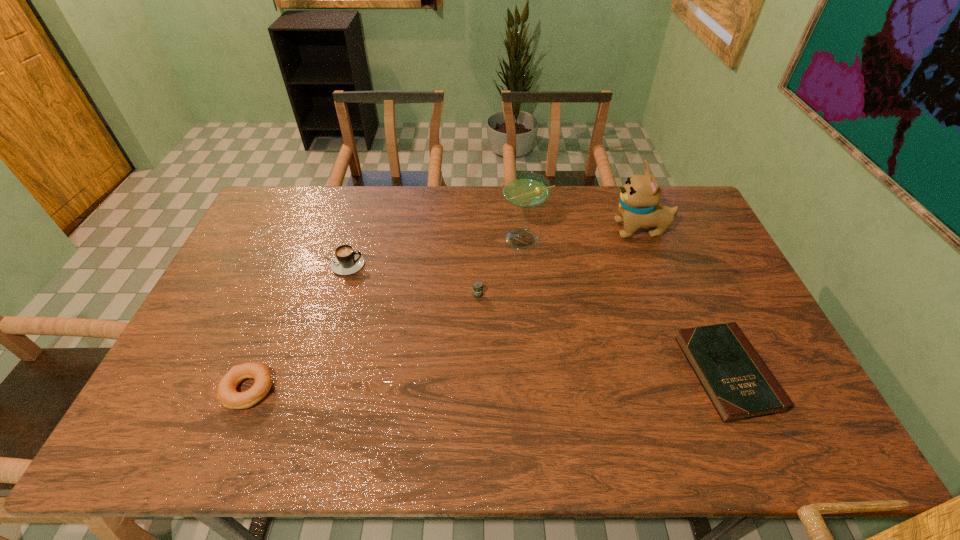
Locate an element on the screen. vacant point located between the bagel and the Bible is located at coordinates (488, 381).

Image resolution: width=960 pixels, height=540 pixels. Find the location of `vacant region between the bagel and the fourth object from right to left`. vacant region between the bagel and the fourth object from right to left is located at coordinates (363, 342).

Where is `free space between the Bible and the beer can`? free space between the Bible and the beer can is located at coordinates click(x=603, y=334).

Identify the location of free space between the martini and the bagel. Image resolution: width=960 pixels, height=540 pixels. (386, 315).

The width and height of the screenshot is (960, 540). Identify the location of free space between the bagel and the martini. (386, 315).

This screenshot has height=540, width=960. I want to click on free space that is in between the bagel and the Bible, so click(x=488, y=381).

I want to click on vacant area between the cappuccino and the third nearest object, so click(410, 280).

The height and width of the screenshot is (540, 960). I want to click on free point between the Bible and the puppy, so click(x=684, y=301).

You are a GUI agent. You are given a task and a screenshot of the screen. Output one action in this format:
    pyautogui.click(x=<x>, y=<y>)
    Task: Click on the fourth closest object to the Bible
    The image size is (960, 540).
    Given the screenshot: What is the action you would take?
    pyautogui.click(x=346, y=262)

Find the location of `object that ranks as the third closest to the bagel`. object that ranks as the third closest to the bagel is located at coordinates [x=526, y=190].